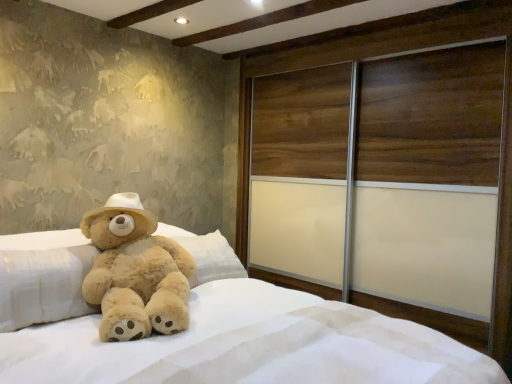
Question: From the image's perspective, relative to wooden sliding door at right, is soft plush bear at center above or below?

Choices:
 (A) below
 (B) above

Answer: (A)

Question: Based on their sizes in the image, would you say soft plush bear at center is bigger or smaller than wooden sliding door at right?

Choices:
 (A) small
 (B) big

Answer: (B)

Question: Estimate the real-world distances between objects in this image. Which object is closer to the wooden sliding door at right?

Choices:
 (A) soft plush bear at center
 (B) fuzzy beige teddy bear at left

Answer: (A)

Question: Estimate the real-world distances between objects in this image. Which object is closer to the soft plush bear at center?

Choices:
 (A) wooden sliding door at right
 (B) fuzzy beige teddy bear at left

Answer: (B)